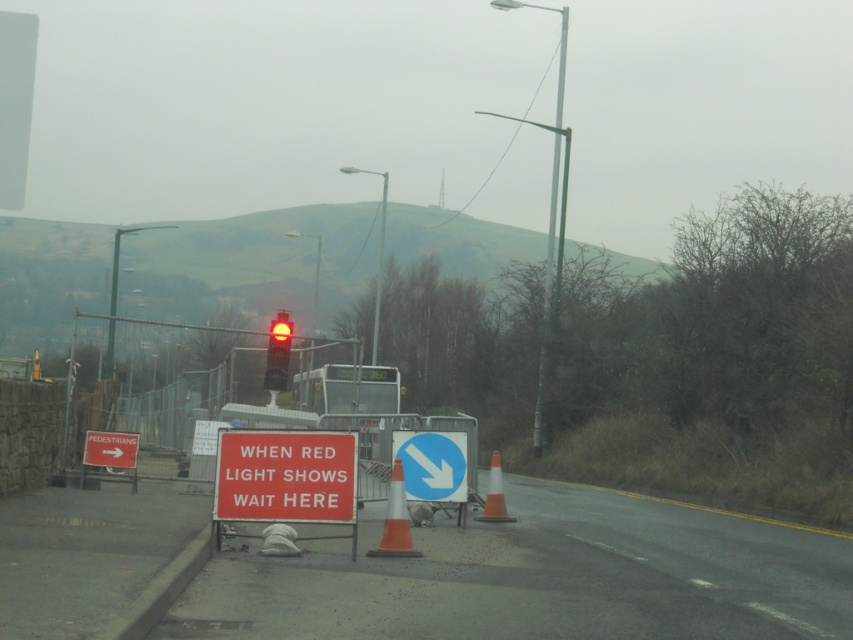
You are a pedestrian waiting at the intersection. The white plastic sign at left says to go right, and the orange reflective cone at center marks a hazard. Considering their heights, which object is easier to see from a distance?

The white plastic sign at left is much taller than the orange reflective cone at center, so it is easier to see from a distance.

You are a pedestrian standing at the intersection and need to cross the road. The traffic light shows red, and you see the blue plastic traffic sign at center. According to the sign, where should you wait before proceeding?

The blue plastic traffic sign at center is positioned at point (432, 465), so you should wait at this location until it is safe to cross.